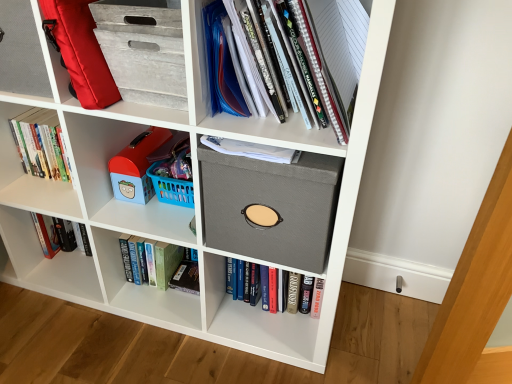
Question: From the image's perspective, is matte plastic toy at left, which is the second shelf from front to back, above or below hardcover book at center, placed as the 3th book when sorted from left to right?

Choices:
 (A) above
 (B) below

Answer: (A)

Question: Considering the positions of matte plastic toy at left, the first shelf from the left, and hardcover book at center, marked as the first book in a right-to-left arrangement, in the image, is matte plastic toy at left, the first shelf from the left, taller or shorter than hardcover book at center, marked as the first book in a right-to-left arrangement,?

Choices:
 (A) short
 (B) tall

Answer: (A)

Question: Estimate the real-world distances between objects in this image. Which object is closer to the gray fabric storage box at center?

Choices:
 (A) hardcover book at lower left, which is the 2th book from bottom to top
 (B) matte gray folder at upper right, which appears as the 1th shelf when viewed from the front
 (C) hardcover book at left, positioned as the first book in top-to-bottom order
 (D) gray textured storage bin at upper left
 (E) hardcover book at center, placed as the 1th book when sorted from bottom to top

Answer: (B)

Question: Which object is the farthest from the red fabric backpack at upper left?

Choices:
 (A) blue plastic toy at center-left
 (B) gray textured storage bin at upper left
 (C) hardcover book at center, placed as the 1th book when sorted from bottom to top
 (D) gray fabric storage box at center
 (E) matte gray folder at upper right, placed as the 2th shelf when sorted from left to right

Answer: (C)